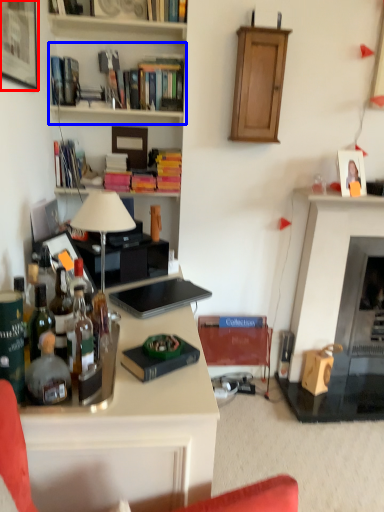
Question: Which of the following is the farthest to the observer, picture frame (highlighted by a red box) or shelf (highlighted by a blue box)?

Choices:
 (A) picture frame
 (B) shelf

Answer: (B)